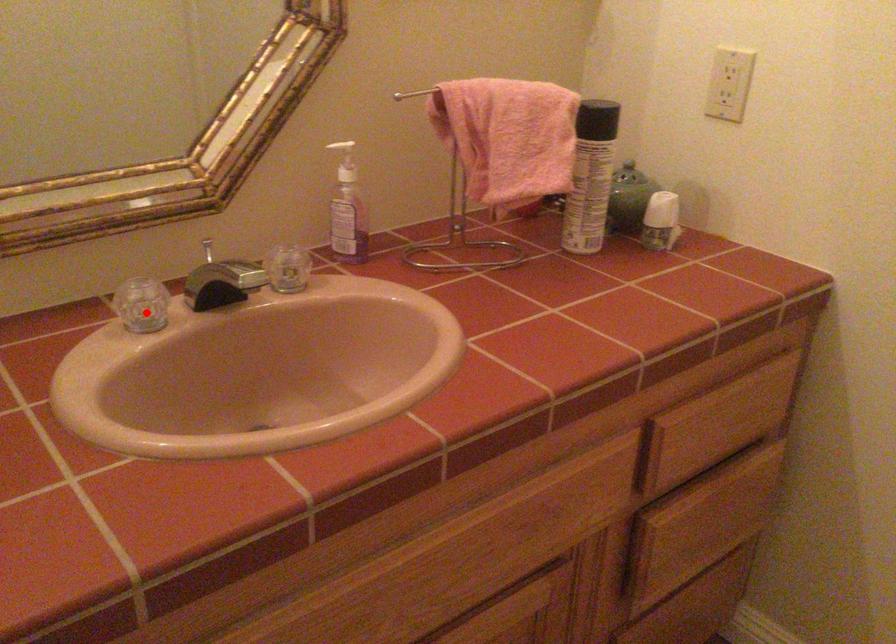
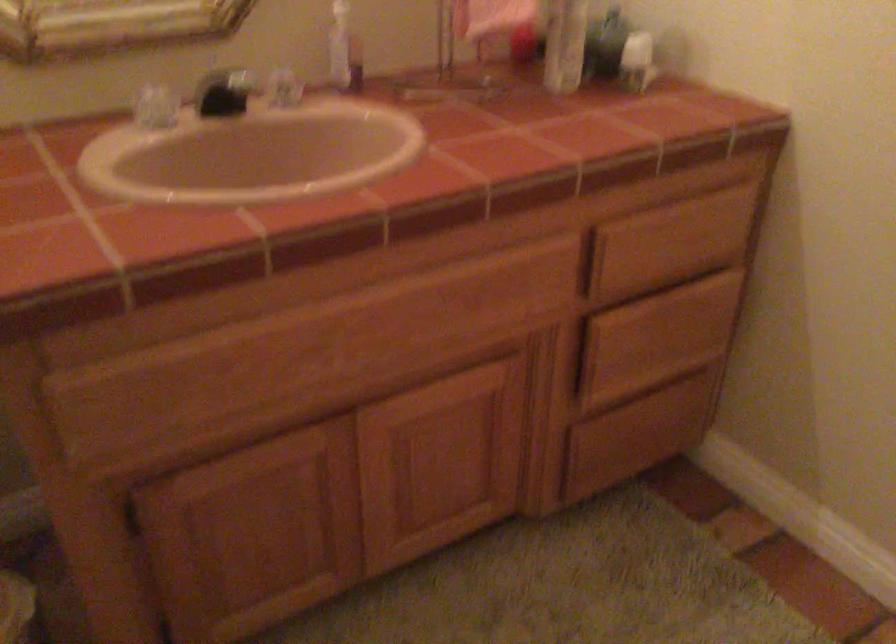
Find the pixel in the second image that matches the highlighted location in the first image.

(156, 106)